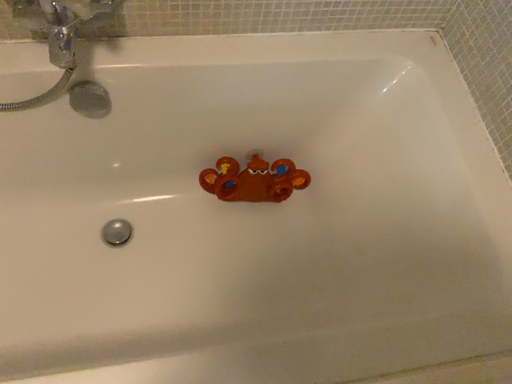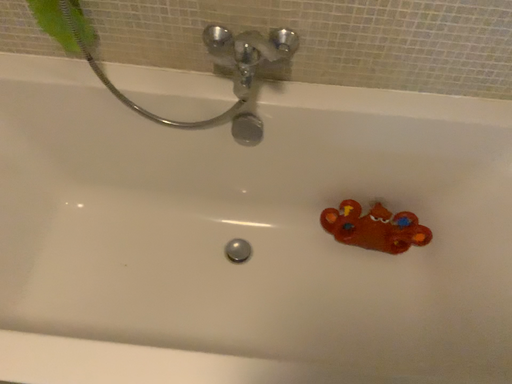
Question: How did the camera likely rotate when shooting the video?

Choices:
 (A) rotated downward
 (B) rotated upward

Answer: (B)